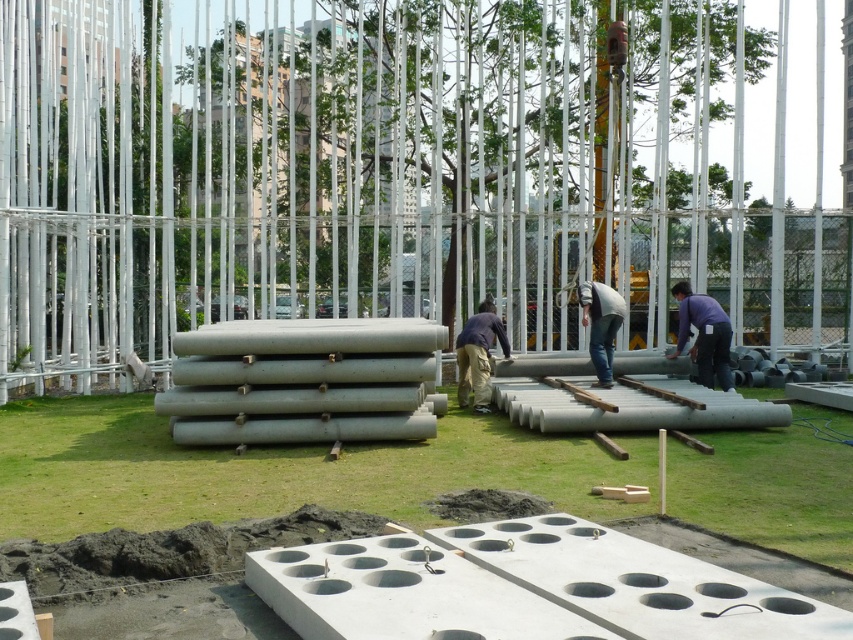
You are a safety inspector standing at the edge of the construction site. You notice the gray concrete at center and the dark blue shirt at center. Which object is taller?

The gray concrete at center is not as tall as the dark blue shirt at center, so the dark blue shirt at center is taller.

You are a safety inspector at the construction site. You notice the gray concrete at center and the purple matte shirt at center. According to safety protocols, workers must maintain a distance of at least 2 meters from any heavy equipment or materials. Are the workers in compliance with this rule?

The gray concrete at center is in front of the purple matte shirt at center, meaning the worker in the purple matte shirt at center is closer to the concrete than the required 2 meters. Therefore, they are not in compliance with the safety protocols.

Looking at this image, you are a safety inspector checking the construction site. You notice two objects at the center of the image. One is a dark blue shirt and the other is a gray matte concrete. According to safety regulations, workers must keep a distance of at least 1 meter from any heavy machinery. Can you determine if the dark blue shirt at center is positioned safely away from the gray matte concrete at center based on their sizes?

The dark blue shirt at center is larger in width than the gray matte concrete at center. However, the distance between them cannot be determined solely by their sizes. Safety regulations require a minimum distance of 1 meter from heavy machinery, but without knowing the actual distance between the two objects, it is impossible to confirm compliance. Please measure the distance directly.